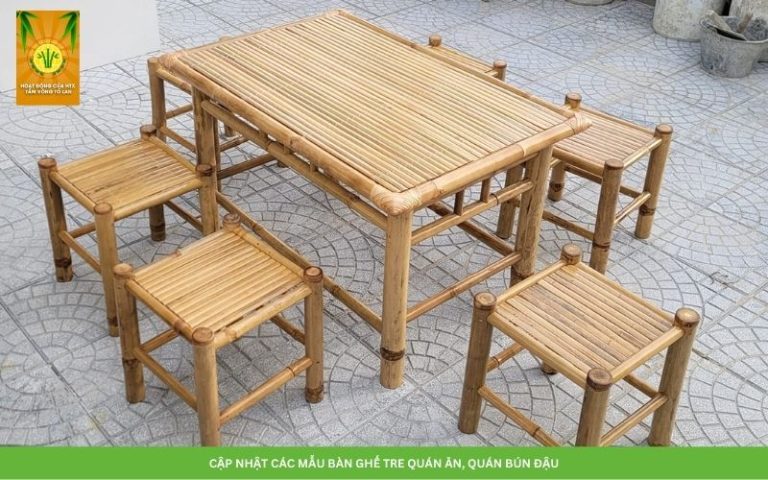
The image size is (768, 480). Find the location of `light gray wall`. light gray wall is located at coordinates (136, 23).